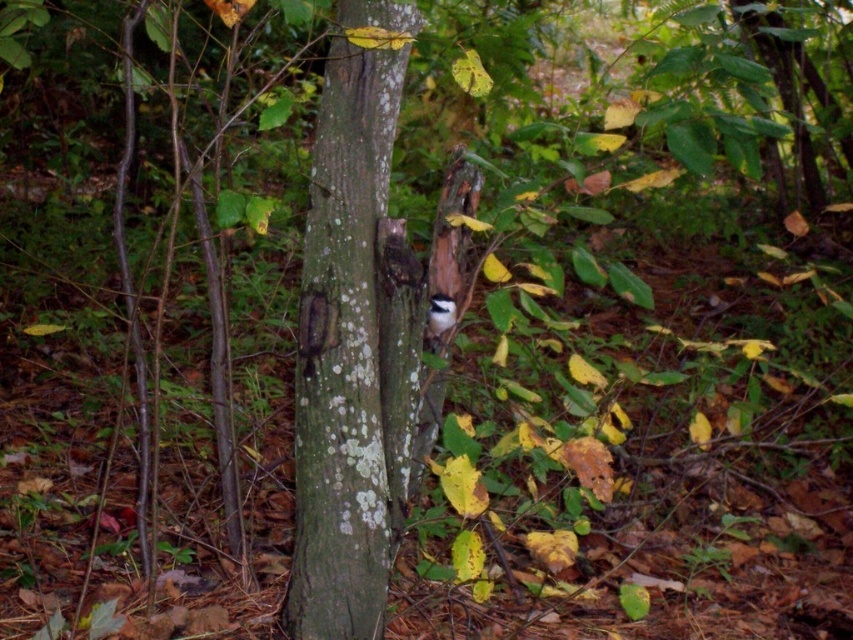
You are standing in a forest and looking at the green rough bark tree trunk at center. If you want to touch it, how many steps would you need to take if each step covers approximately 0.75 meters?

The green rough bark tree trunk at center is 1.94 meters away from the camera. Since each step covers 0.75 meters, you would need to take approximately 3 steps to reach it.

You are a hiker who wants to take a photo of the green rough bark tree trunk at center and the white fluffy bird at center. Which object should you focus on first if you want to capture both in the same frame without moving the camera?

The green rough bark tree trunk at center is much taller than the white fluffy bird at center, so you should focus on the tree trunk first to ensure it fits in the frame before the bird moves.